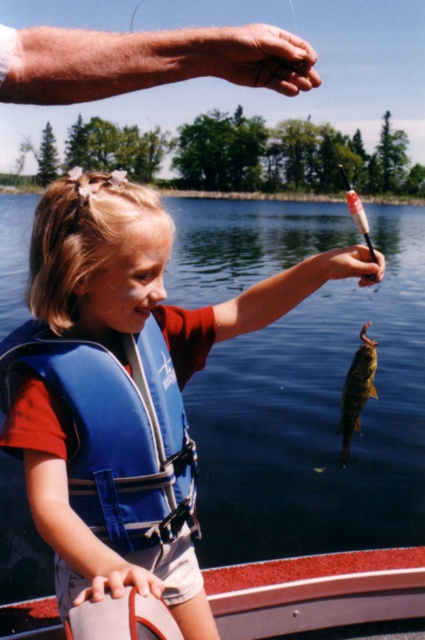
Can you confirm if blue life vest at center is wider than blue fabric life jacket at left?

Correct, the width of blue life vest at center exceeds that of blue fabric life jacket at left.

Measure the distance between point (104, 589) and camera.

The distance of point (104, 589) from camera is 3.65 feet.

The width and height of the screenshot is (425, 640). Find the location of `blue life vest at center`. blue life vest at center is located at coordinates (147, 282).

Does blue life vest at center have a larger size compared to gray fabric boat at lower center?

Yes, blue life vest at center is bigger than gray fabric boat at lower center.

Is blue life vest at center to the left of gray fabric boat at lower center from the viewer's perspective?

Indeed, blue life vest at center is positioned on the left side of gray fabric boat at lower center.

This screenshot has width=425, height=640. Identify the location of blue life vest at center. (147, 282).

Locate an element on the screen. The width and height of the screenshot is (425, 640). blue life vest at center is located at coordinates tap(147, 282).

Is blue fabric life jacket at left smaller than shiny golden fish at lower right?

Incorrect, blue fabric life jacket at left is not smaller in size than shiny golden fish at lower right.

Is blue fabric life jacket at left above shiny golden fish at lower right?

No, blue fabric life jacket at left is not above shiny golden fish at lower right.

Is point (175, 416) positioned in front of point (362, 374)?

Yes, point (175, 416) is closer to viewer.

Where is `blue fabric life jacket at left`? The width and height of the screenshot is (425, 640). blue fabric life jacket at left is located at coordinates (116, 429).